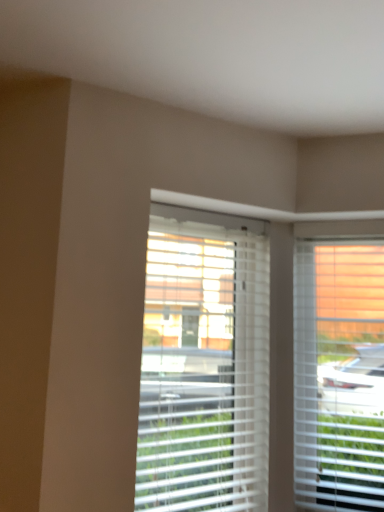
Image resolution: width=384 pixels, height=512 pixels. What do you see at coordinates (204, 364) in the screenshot?
I see `white plastic blinds at center` at bounding box center [204, 364].

You are a GUI agent. You are given a task and a screenshot of the screen. Output one action in this format:
    pyautogui.click(x=<x>, y=<y>)
    Task: Click on the white plastic blinds at center
    The image size is (384, 512).
    Given the screenshot: What is the action you would take?
    pyautogui.click(x=204, y=364)

What are the coordinates of `white plastic blinds at center` in the screenshot? It's located at (204, 364).